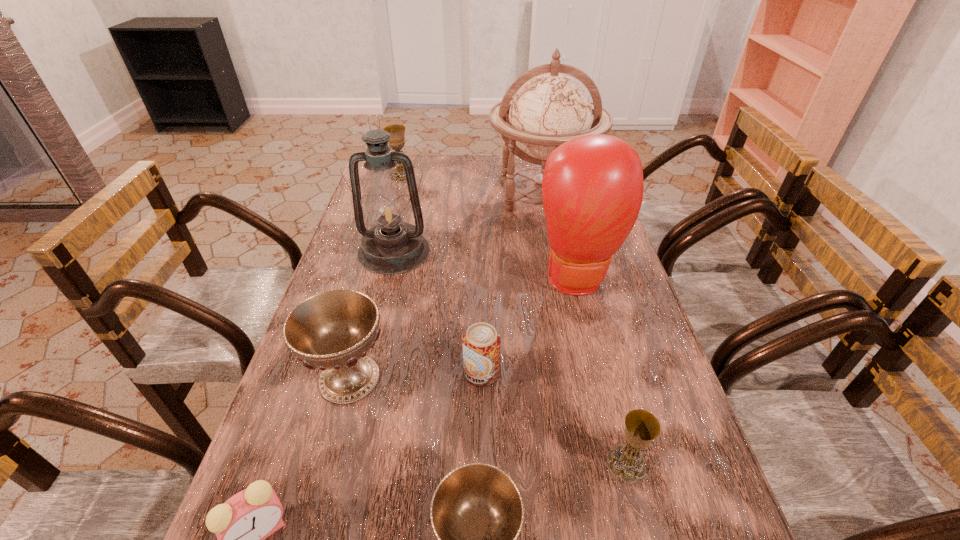
You are a GUI agent. You are given a task and a screenshot of the screen. Output one action in this format:
    pyautogui.click(x=<x>, y=<y>)
    Task: Click on the globe
    
    Given the screenshot: What is the action you would take?
    pyautogui.click(x=550, y=109)

Where is `oil lamp`? The height and width of the screenshot is (540, 960). oil lamp is located at coordinates (391, 247).

The image size is (960, 540). I want to click on red boxing glove, so click(592, 188).

Locate an element on the screen. This screenshot has height=540, width=960. the left gold chalice is located at coordinates (397, 132).

Find the location of a particular element. Image resolution: width=960 pixels, height=540 pixels. the farthest chalice is located at coordinates (397, 132).

The image size is (960, 540). What are the coordinates of `the bigger red chalice` in the screenshot? It's located at (333, 330).

Identify the location of the third nearest chalice. (333, 330).

Where is `the right gold chalice`? This screenshot has width=960, height=540. the right gold chalice is located at coordinates (641, 427).

In order to click on the third nearest object in this screenshot , I will do coord(641,427).

Locate an element on the screen. Image resolution: width=960 pixels, height=540 pixels. beer can is located at coordinates (481, 343).